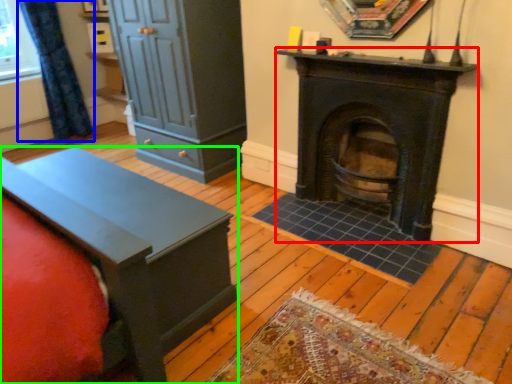
Question: Estimate the real-world distances between objects in this image. Which object is farther from wood burning stove (highlighted by a red box), curtain (highlighted by a blue box) or furniture (highlighted by a green box)?

Choices:
 (A) curtain
 (B) furniture

Answer: (A)